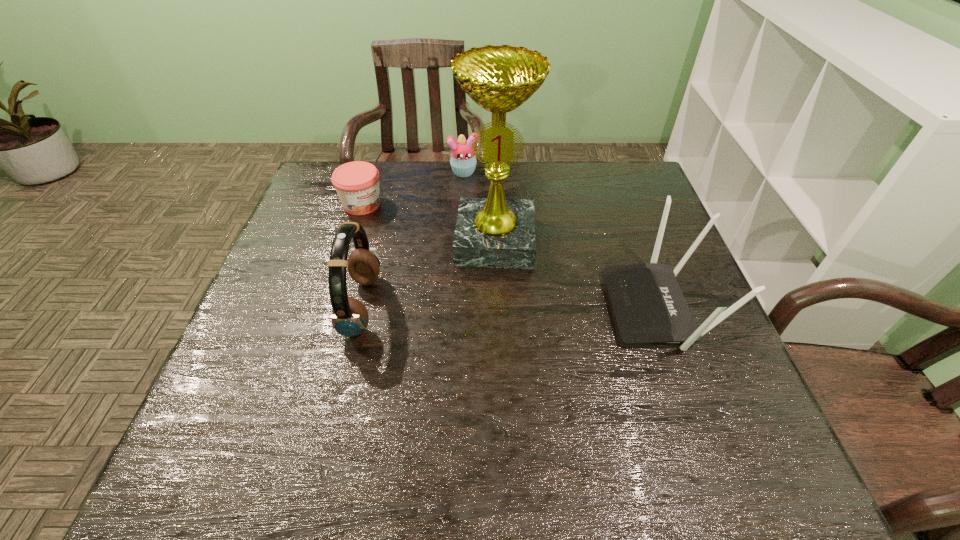
Find the location of `blank space located on the front-facing side of the router`. blank space located on the front-facing side of the router is located at coordinates (565, 308).

Image resolution: width=960 pixels, height=540 pixels. Identify the location of free location located on the front-facing side of the router. (544, 308).

The height and width of the screenshot is (540, 960). I want to click on free space located on the front-facing side of the award, so click(x=490, y=345).

This screenshot has height=540, width=960. In order to click on free space located 0.280m on the front-facing side of the award in this screenshot , I will do `click(489, 365)`.

I want to click on vacant space located 0.240m on the front-facing side of the award, so click(x=490, y=349).

Find the location of a particular element. The width and height of the screenshot is (960, 540). blank area located on the front label of the shortest object is located at coordinates (461, 288).

Find the location of `free space located on the front label of the shortest object`. free space located on the front label of the shortest object is located at coordinates (425, 258).

Identify the location of vacant area situated on the front label of the shortest object. (398, 235).

Locate an element on the screen. vacant area situated 0.260m on the face of the farthest object is located at coordinates (476, 233).

You are a GUI agent. You are given a task and a screenshot of the screen. Output one action in this format:
    pyautogui.click(x=<x>, y=<y>)
    Task: Click on the vacant region located on the face of the farthest object
    
    Given the screenshot: What is the action you would take?
    pos(471,208)